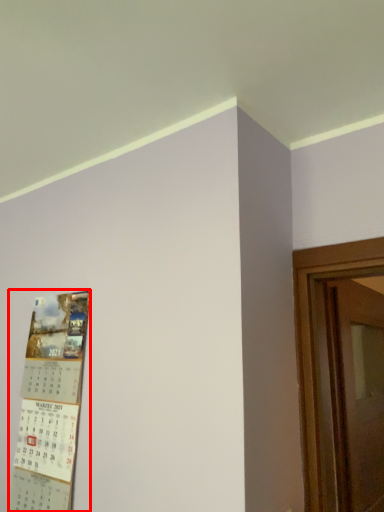
Question: From the image's perspective, where is poster (annotated by the red box) located relative to door?

Choices:
 (A) below
 (B) above

Answer: (B)